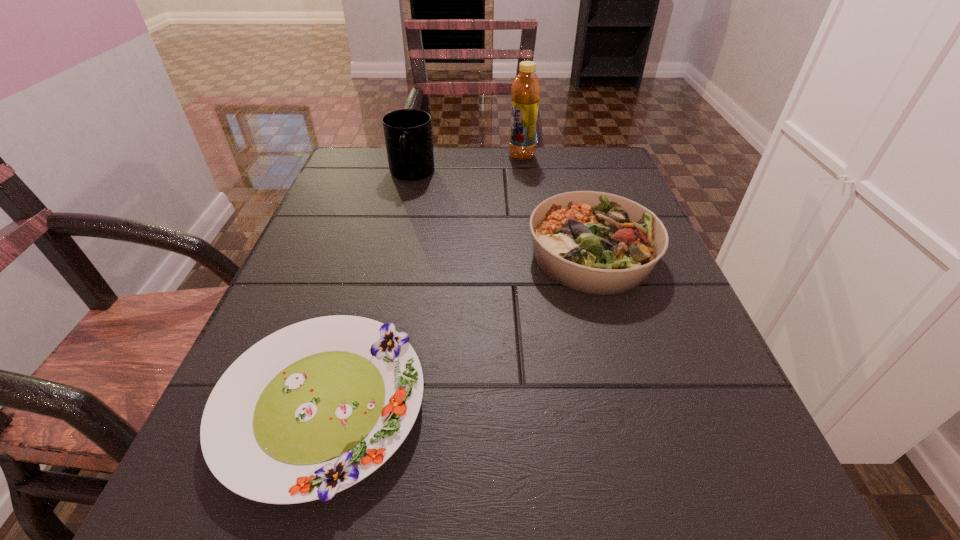
I want to click on the tallest object, so click(x=526, y=88).

Find the location of a particular element. Image resolution: width=960 pixels, height=540 pixels. mug is located at coordinates (408, 132).

Find the location of a particular element. the taller salad plate is located at coordinates (594, 242).

Identify the location of the right salad plate. The width and height of the screenshot is (960, 540). (594, 242).

Locate an element on the screen. Image resolution: width=960 pixels, height=540 pixels. the shorter salad plate is located at coordinates (312, 409).

Identify the location of the nearest object. The image size is (960, 540). (312, 409).

The image size is (960, 540). Identify the location of vacant space located 0.350m on the left of the bottle. (372, 156).

Where is `vacant space located on the side of the mug with the handle`? This screenshot has height=540, width=960. vacant space located on the side of the mug with the handle is located at coordinates (386, 286).

Image resolution: width=960 pixels, height=540 pixels. Identify the location of free space located on the front of the farther salad plate. (635, 400).

The image size is (960, 540). In order to click on free spot located on the right of the left salad plate in this screenshot , I will do `click(634, 406)`.